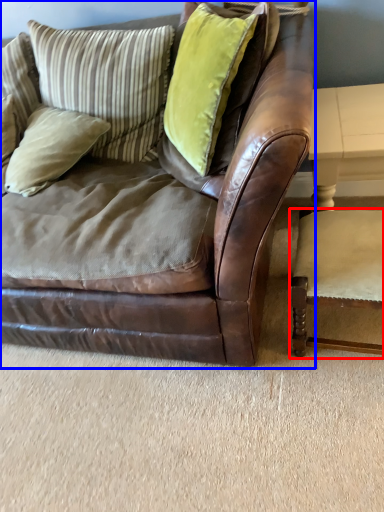
Question: Which object is further to the camera taking this photo, chair (highlighted by a red box) or studio couch (highlighted by a blue box)?

Choices:
 (A) chair
 (B) studio couch

Answer: (A)